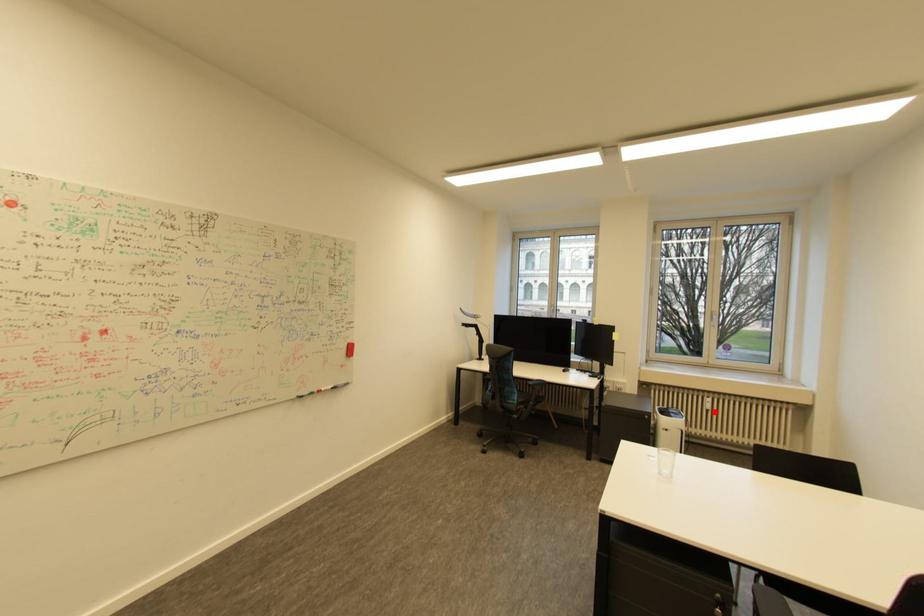
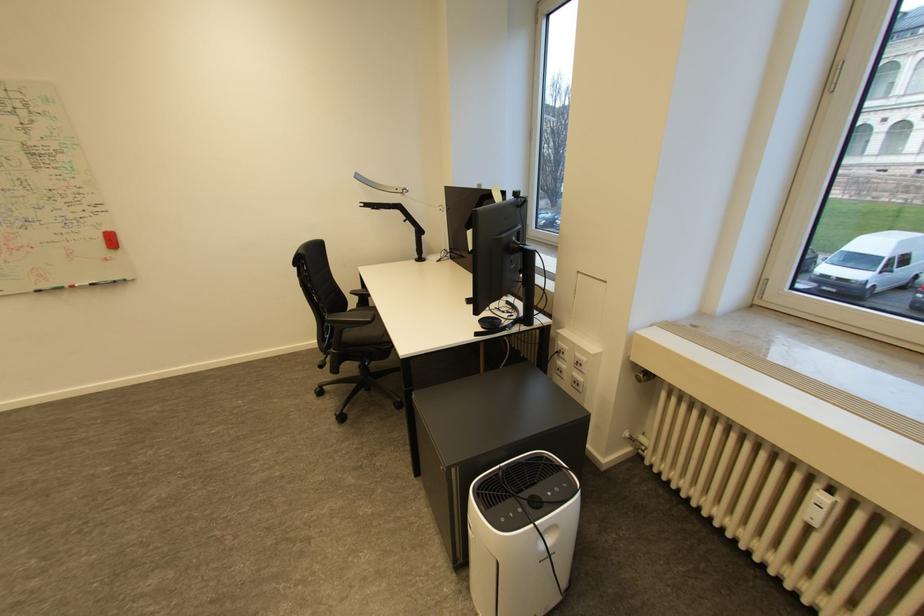
In the second image, find the point that corresponds to the highlighted location in the first image.

(816, 525)